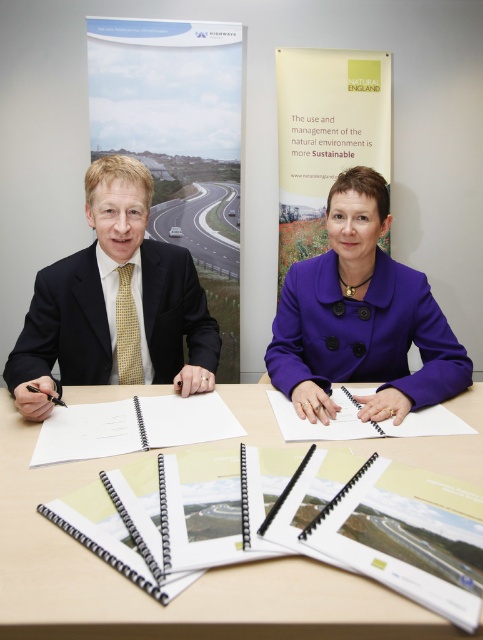
Between wooden table at center and matte black suit at left, which one appears on the left side from the viewer's perspective?

Positioned to the left is matte black suit at left.

Measure the distance between point (257,564) and camera.

Point (257,564) is 72.50 centimeters away from camera.

At what (x,y) coordinates should I click in order to perform the action: click on wooden table at center. Please return your answer as a coordinate pair (x, y). This screenshot has width=483, height=640. Looking at the image, I should click on (181, 593).

Can you confirm if matte black suit at left is shorter than matte yellow tie at left?

Yes, matte black suit at left is shorter than matte yellow tie at left.

Does point (101, 355) come closer to viewer compared to point (87, 182)?

That is False.

You are a GUI agent. You are given a task and a screenshot of the screen. Output one action in this format:
    pyautogui.click(x=<x>, y=<y>)
    Task: Click on the matte black suit at left
    The height and width of the screenshot is (640, 483).
    Given the screenshot: What is the action you would take?
    pyautogui.click(x=113, y=305)

Where is `matte black suit at left`? Image resolution: width=483 pixels, height=640 pixels. matte black suit at left is located at coordinates (113, 305).

Is point (16, 339) closer to camera compared to point (356, 276)?

No, (16, 339) is behind (356, 276).

What do you see at coordinates (114, 305) in the screenshot? I see `matte yellow tie at left` at bounding box center [114, 305].

Is point (10, 365) farther from camera compared to point (384, 371)?

No, (10, 365) is closer to viewer.

Where is `matte yellow tie at left`? Image resolution: width=483 pixels, height=640 pixels. matte yellow tie at left is located at coordinates (114, 305).